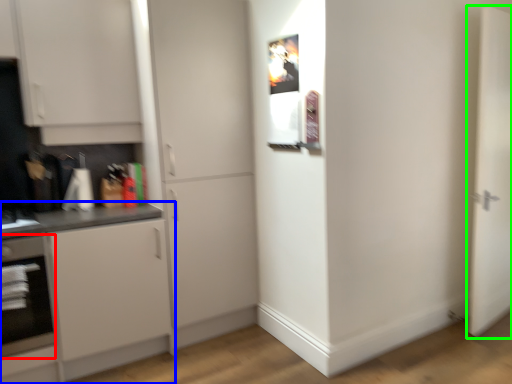
Question: Which is nearer to the oven (highlighted by a red box)? cabinetry (highlighted by a blue box) or door (highlighted by a green box).

Choices:
 (A) cabinetry
 (B) door

Answer: (A)